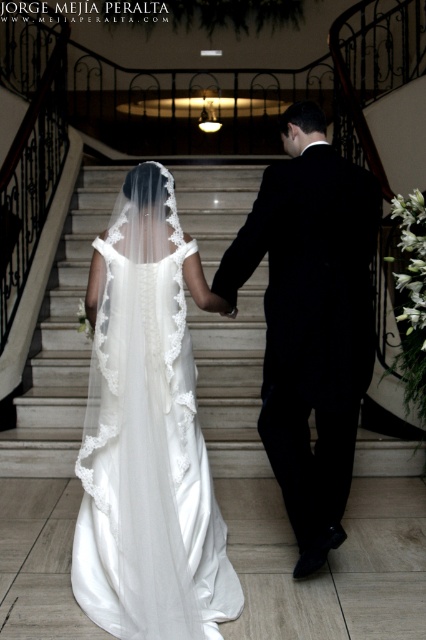
You are a photographer at the bottom of the staircase and want to capture a photo of the black satin suit at center and white marble stairs at center. Which object is closer to you?

The black satin suit at center is shorter than the white marble stairs at center, so the black satin suit at center is closer to you.

You are a photographer positioned at the bottom of the staircase. You want to capture a closeup shot of the white satin dress at center. The camera can focus on objects within 2 meters. Will you be able to take the closeup shot?

The white satin dress at center is 2.53 meters from camera, which is beyond the camera focus range of 2 meters. Therefore, you cannot take the closeup shot.